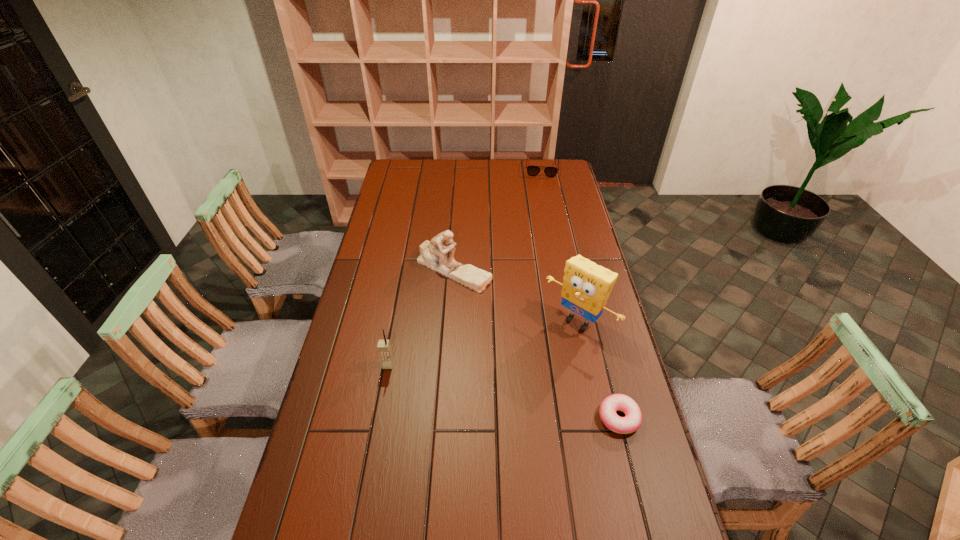
Locate an element on the screen. Image resolution: width=960 pixels, height=540 pixels. free space that satisfies the following two spatial constraints: 1. on the front side of the second object from left to right; 2. on the left side of the third farthest object is located at coordinates (450, 321).

Find the location of a particular element. The height and width of the screenshot is (540, 960). vacant region that satisfies the following two spatial constraints: 1. on the front side of the figurine; 2. on the left side of the tallest object is located at coordinates (450, 321).